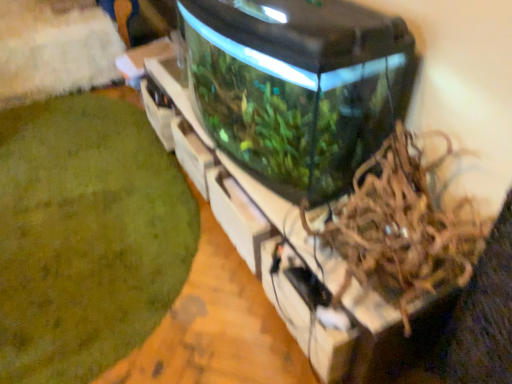
Where is `free region under green moss at lower left (from a real-world perspective)`? free region under green moss at lower left (from a real-world perspective) is located at coordinates (97, 195).